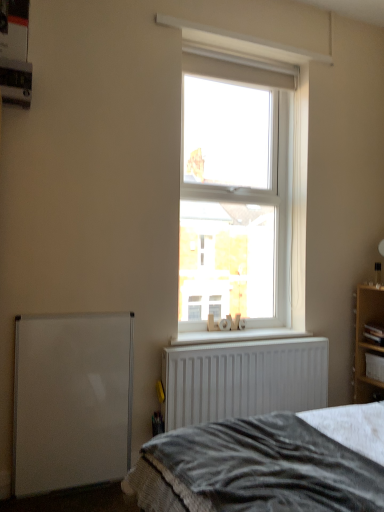
Question: From the image's perspective, is white textured wood at center under wooden cabinet at right?

Choices:
 (A) yes
 (B) no

Answer: (B)

Question: Does white textured wood at center appear on the left side of wooden cabinet at right?

Choices:
 (A) yes
 (B) no

Answer: (A)

Question: Is white textured wood at center shorter than wooden cabinet at right?

Choices:
 (A) no
 (B) yes

Answer: (B)

Question: Can you confirm if white textured wood at center is wider than wooden cabinet at right?

Choices:
 (A) yes
 (B) no

Answer: (A)

Question: Considering the relative positions of white textured wood at center and wooden cabinet at right in the image provided, is white textured wood at center behind wooden cabinet at right?

Choices:
 (A) no
 (B) yes

Answer: (A)

Question: From the image's perspective, is white matte whiteboard at lower left located above or below wooden shelf at right?

Choices:
 (A) above
 (B) below

Answer: (B)

Question: Considering the positions of white matte whiteboard at lower left and wooden shelf at right in the image, is white matte whiteboard at lower left taller or shorter than wooden shelf at right?

Choices:
 (A) tall
 (B) short

Answer: (A)

Question: Is white matte whiteboard at lower left to the left or to the right of wooden shelf at right in the image?

Choices:
 (A) right
 (B) left

Answer: (B)

Question: Is point (66, 429) positioned closer to the camera than point (370, 351)?

Choices:
 (A) farther
 (B) closer

Answer: (B)

Question: Is point (375, 352) positioned closer to the camera than point (264, 96)?

Choices:
 (A) closer
 (B) farther

Answer: (A)

Question: Considering the positions of wooden cabinet at right and clear glass window at center in the image, is wooden cabinet at right taller or shorter than clear glass window at center?

Choices:
 (A) short
 (B) tall

Answer: (A)

Question: Do you think wooden cabinet at right is within clear glass window at center, or outside of it?

Choices:
 (A) inside
 (B) outside

Answer: (B)

Question: From the image's perspective, is wooden cabinet at right located above or below clear glass window at center?

Choices:
 (A) below
 (B) above

Answer: (A)

Question: In the image, is wooden cabinet at right on the left side or the right side of wooden shelf at right?

Choices:
 (A) right
 (B) left

Answer: (B)

Question: From the image's perspective, is wooden cabinet at right positioned above or below wooden shelf at right?

Choices:
 (A) below
 (B) above

Answer: (A)